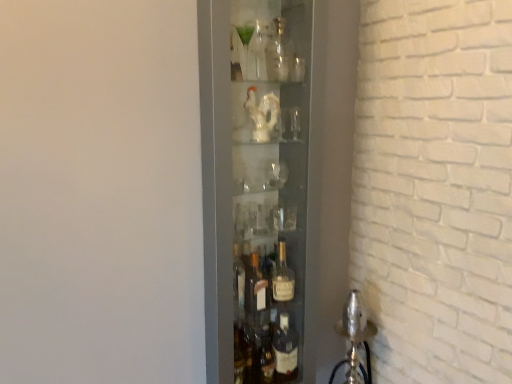
Question: Relative to translucent glass bottle at center, which is the 3th bottle in front-to-back order, is clear glass bottle at upper center, which is the 3th bottle in bottom-to-top order, in front or behind?

Choices:
 (A) front
 (B) behind

Answer: (A)

Question: Do you think clear glass bottle at upper center, the second bottle positioned from the front, is within translucent glass bottle at center, acting as the first bottle starting from the back, or outside of it?

Choices:
 (A) inside
 (B) outside

Answer: (B)

Question: Which of these objects is positioned farthest from the transparent glass bottles at center?

Choices:
 (A) translucent glass bottle at center, which is the 3th bottle in front-to-back order
 (B) clear glass shot glass at upper center
 (C) clear glass bottle at upper center, acting as the 2th bottle starting from the back
 (D) clear glass bottle at center, the second bottle in the top-to-bottom sequence

Answer: (D)

Question: Which is nearer to the clear glass bottle at upper center, acting as the 2th bottle starting from the back?

Choices:
 (A) clear glass shot glass at upper center
 (B) clear glass bottle at center, which is counted as the third bottle, starting from the back
 (C) translucent glass bottle at center, acting as the first bottle starting from the back
 (D) transparent glass bottles at center

Answer: (B)